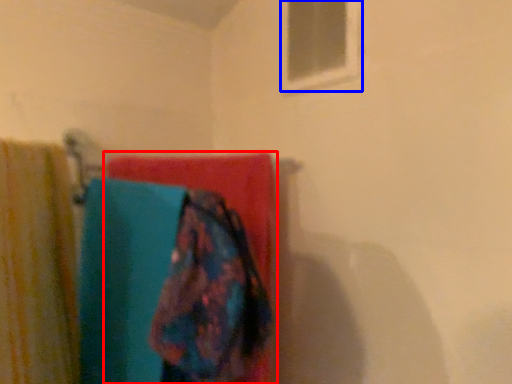
Question: Which of the following is the farthest to the observer, towel (highlighted by a red box) or window (highlighted by a blue box)?

Choices:
 (A) towel
 (B) window

Answer: (B)